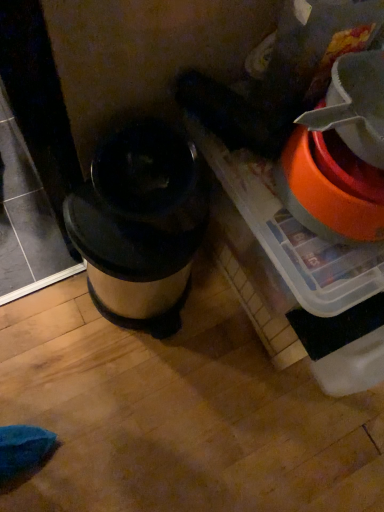
I want to click on vacant space in front of metallic silver trash can at center, so click(117, 389).